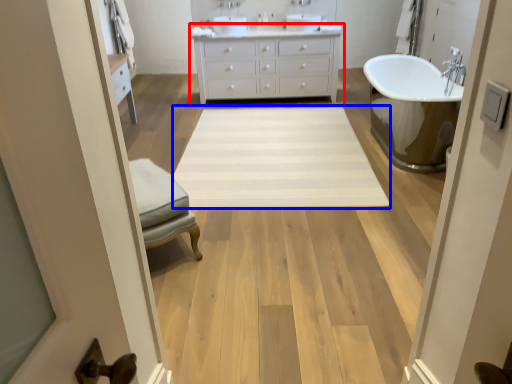
Question: Which object appears farthest to the camera in this image, bathroom cabinet (highlighted by a red box) or plain (highlighted by a blue box)?

Choices:
 (A) bathroom cabinet
 (B) plain

Answer: (A)